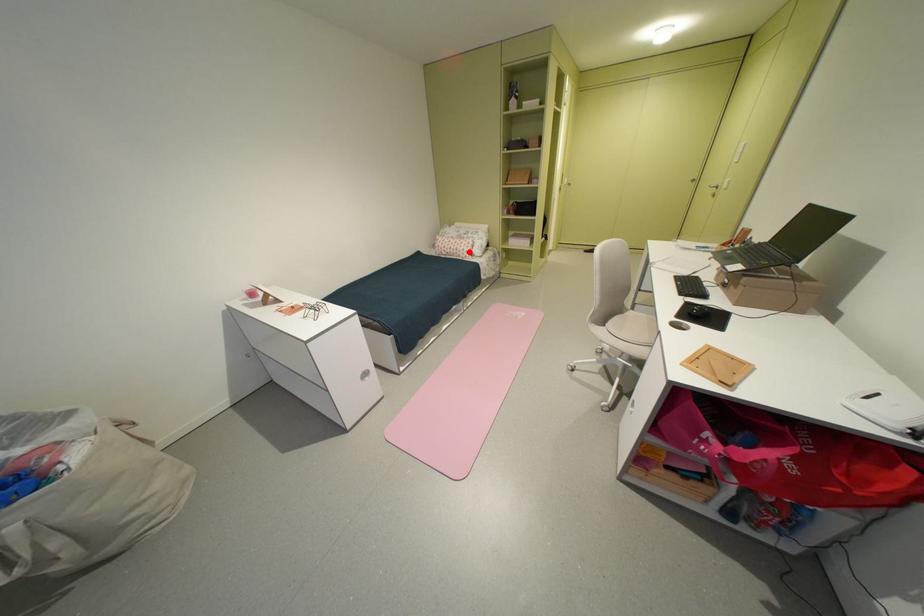
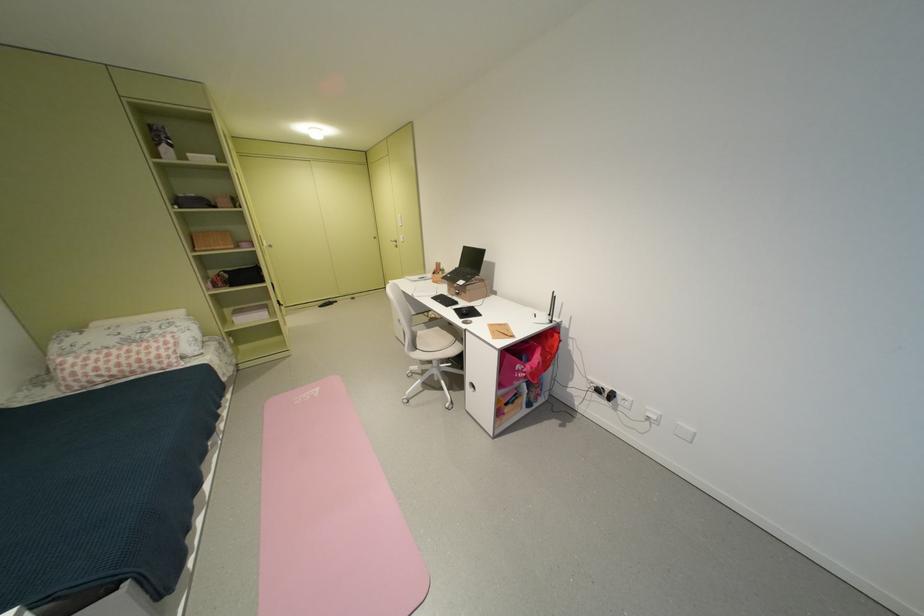
Locate, in the second image, the point that corresponds to the highlighted location in the first image.

(159, 362)